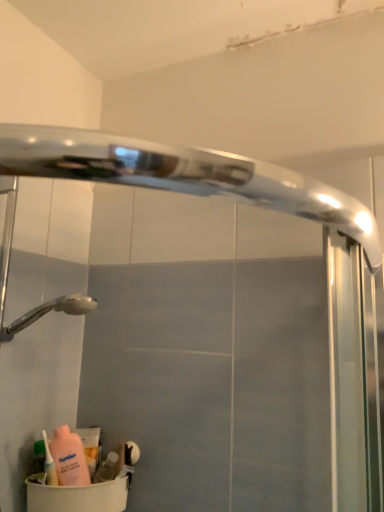
Describe the element at coordinates (90, 447) in the screenshot. I see `matte pink lotion at lower left, which is the second cleaning product in left-to-right order` at that location.

Locate an element on the screen. The image size is (384, 512). pink matte bottle at lower left, which is counted as the first cleaning product, starting from the left is located at coordinates (49, 463).

What do you see at coordinates (49, 463) in the screenshot? The height and width of the screenshot is (512, 384). I see `pink matte bottle at lower left, placed as the 2th cleaning product when sorted from right to left` at bounding box center [49, 463].

What do you see at coordinates (77, 496) in the screenshot?
I see `beige plastic container at lower left` at bounding box center [77, 496].

Find the location of a particular element. This screenshot has height=512, width=384. translucent plastic soap at lower left, acting as the 2th toiletry starting from the left is located at coordinates (107, 468).

Is matte pink lotion at lower left, positioned as the 1th cleaning product in back-to-front order, in front of or behind beige plastic container at lower left in the image?

Visually, matte pink lotion at lower left, positioned as the 1th cleaning product in back-to-front order, is located behind beige plastic container at lower left.

Does matte pink lotion at lower left, positioned as the 1th cleaning product in back-to-front order, appear on the left side of beige plastic container at lower left?

In fact, matte pink lotion at lower left, positioned as the 1th cleaning product in back-to-front order, is to the right of beige plastic container at lower left.

From a real-world perspective, relative to beige plastic container at lower left, is matte pink lotion at lower left, positioned as the 1th cleaning product in back-to-front order, vertically above or below?

In terms of real-world spatial position, matte pink lotion at lower left, positioned as the 1th cleaning product in back-to-front order, is above beige plastic container at lower left.

How many degrees apart are the facing directions of matte pink lotion at lower left, acting as the 2th cleaning product starting from the front, and pink matte bottle at lower left, placed as the 2th cleaning product when sorted from right to left?

4.29 degrees.

From the image's perspective, is matte pink lotion at lower left, which is the second cleaning product in left-to-right order, above or below pink matte bottle at lower left, which is counted as the first cleaning product, starting from the left?

A: Based on their image positions, matte pink lotion at lower left, which is the second cleaning product in left-to-right order, is located beneath pink matte bottle at lower left, which is counted as the first cleaning product, starting from the left.

Is point (92, 458) closer or farther from the camera than point (47, 472)?

Clearly, point (92, 458) is more distant from the camera than point (47, 472).

Between matte pink lotion at lower left, which is the second cleaning product in left-to-right order, and pink matte bottle at lower left, which is counted as the first cleaning product, starting from the left, which one has larger width?

matte pink lotion at lower left, which is the second cleaning product in left-to-right order.

Could you tell me if beige plastic container at lower left is turned towards green matte bottle at lower left, the first toiletry in the left-to-right sequence?

No, beige plastic container at lower left does not turn towards green matte bottle at lower left, the first toiletry in the left-to-right sequence.

From the image's perspective, is beige plastic container at lower left beneath green matte bottle at lower left, the first toiletry in the left-to-right sequence?

Yes.

Based on their positions, is beige plastic container at lower left located to the left or right of green matte bottle at lower left, which appears as the second toiletry when viewed from the right?

From the image, it's evident that beige plastic container at lower left is to the right of green matte bottle at lower left, which appears as the second toiletry when viewed from the right.

Is beige plastic container at lower left thinner than green matte bottle at lower left, which appears as the second toiletry when viewed from the right?

No, beige plastic container at lower left is not thinner than green matte bottle at lower left, which appears as the second toiletry when viewed from the right.

Based on the photo, from the image's perspective, is green matte bottle at lower left, which appears as the second toiletry when viewed from the right, on matte pink lotion at lower left, acting as the 2th cleaning product starting from the front?

Yes, from the image's perspective, green matte bottle at lower left, which appears as the second toiletry when viewed from the right, is above matte pink lotion at lower left, acting as the 2th cleaning product starting from the front.

Between point (44, 454) and point (91, 477), which one is positioned behind?

The point (91, 477) is behind.

Is green matte bottle at lower left, the first toiletry in the left-to-right sequence, turned away from matte pink lotion at lower left, which is the second cleaning product in left-to-right order?

green matte bottle at lower left, the first toiletry in the left-to-right sequence, is not turned away from matte pink lotion at lower left, which is the second cleaning product in left-to-right order.

How far apart are green matte bottle at lower left, the first toiletry in the left-to-right sequence, and matte pink lotion at lower left, positioned as the 1th cleaning product in back-to-front order?

green matte bottle at lower left, the first toiletry in the left-to-right sequence, and matte pink lotion at lower left, positioned as the 1th cleaning product in back-to-front order, are 5.20 inches apart.

How much distance is there between beige plastic container at lower left and pink matte bottle at lower left, placed as the 2th cleaning product when sorted from right to left?

The distance of beige plastic container at lower left from pink matte bottle at lower left, placed as the 2th cleaning product when sorted from right to left, is 3.19 inches.

Consider the image. Between beige plastic container at lower left and pink matte bottle at lower left, arranged as the first cleaning product when viewed from the front, which one is positioned behind?

Positioned behind is pink matte bottle at lower left, arranged as the first cleaning product when viewed from the front.

From a real-world perspective, is beige plastic container at lower left on top of pink matte bottle at lower left, arranged as the first cleaning product when viewed from the front?

Incorrect, from a real-world perspective, beige plastic container at lower left is lower than pink matte bottle at lower left, arranged as the first cleaning product when viewed from the front.

Is beige plastic container at lower left looking in the opposite direction of pink matte bottle at lower left, the second cleaning product when ordered from back to front?

No, beige plastic container at lower left is not facing away from pink matte bottle at lower left, the second cleaning product when ordered from back to front.

Locate an element on the screen. Image resolution: width=384 pixels, height=512 pixels. toiletry on the left of pink matte bottle at lower left, arranged as the first cleaning product when viewed from the front is located at coordinates (39, 457).

Does pink matte bottle at lower left, placed as the 2th cleaning product when sorted from right to left, have a greater width compared to green matte bottle at lower left, the first toiletry in the left-to-right sequence?

Yes.

Is pink matte bottle at lower left, arranged as the first cleaning product when viewed from the front, not within green matte bottle at lower left, the first toiletry in the left-to-right sequence?

pink matte bottle at lower left, arranged as the first cleaning product when viewed from the front, lies outside green matte bottle at lower left, the first toiletry in the left-to-right sequence,'s area.

From a real-world perspective, which is physically above, pink matte bottle at lower left, which is counted as the first cleaning product, starting from the left, or green matte bottle at lower left, the first toiletry in the left-to-right sequence?

In real-world perspective, pink matte bottle at lower left, which is counted as the first cleaning product, starting from the left, is above.

There is a beige plastic container at lower left. Find the location of `the 1st cleaning product above it (from a real-world perspective)`. the 1st cleaning product above it (from a real-world perspective) is located at coordinates (90, 447).

Is beige plastic container at lower left positioned with its back to matte pink lotion at lower left, acting as the 2th cleaning product starting from the front?

No, beige plastic container at lower left is not facing the opposite direction of matte pink lotion at lower left, acting as the 2th cleaning product starting from the front.

From the image's perspective, does beige plastic container at lower left appear higher than matte pink lotion at lower left, the 1th cleaning product viewed from the right?

No, from the image's perspective, beige plastic container at lower left is not over matte pink lotion at lower left, the 1th cleaning product viewed from the right.

Considering the positions of objects beige plastic container at lower left and matte pink lotion at lower left, the 1th cleaning product viewed from the right, in the image provided, who is behind, beige plastic container at lower left or matte pink lotion at lower left, the 1th cleaning product viewed from the right,?

matte pink lotion at lower left, the 1th cleaning product viewed from the right, is behind.

The width and height of the screenshot is (384, 512). What are the coordinates of `toilet bowl on the left of the matte pink lotion at lower left, acting as the 2th cleaning product starting from the front` in the screenshot? It's located at (77, 496).

This screenshot has width=384, height=512. I want to click on cleaning product to the right of pink matte bottle at lower left, placed as the 2th cleaning product when sorted from right to left, so coord(90,447).

Which object lies further to the anchor point matte pink lotion at lower left, the 1th cleaning product viewed from the right, green matte bottle at lower left, the first toiletry in the left-to-right sequence, or translucent plastic soap at lower left, acting as the 2th toiletry starting from the left?

The object further to matte pink lotion at lower left, the 1th cleaning product viewed from the right, is green matte bottle at lower left, the first toiletry in the left-to-right sequence.

Based on their spatial positions, is beige plastic container at lower left or translucent plastic soap at lower left, placed as the 1th toiletry when sorted from right to left, closer to pink matte bottle at lower left, arranged as the first cleaning product when viewed from the front?

beige plastic container at lower left lies closer to pink matte bottle at lower left, arranged as the first cleaning product when viewed from the front, than the other object.

Looking at this image, when comparing their distances from beige plastic container at lower left, does pink matte bottle at lower left, arranged as the first cleaning product when viewed from the front, or matte pink lotion at lower left, which is the second cleaning product in left-to-right order, seem closer?

pink matte bottle at lower left, arranged as the first cleaning product when viewed from the front, is positioned closer to the anchor beige plastic container at lower left.

Which object lies further to the anchor point translucent plastic soap at lower left, acting as the 2th toiletry starting from the left, beige plastic container at lower left or green matte bottle at lower left, the first toiletry in the left-to-right sequence?

green matte bottle at lower left, the first toiletry in the left-to-right sequence, is further to translucent plastic soap at lower left, acting as the 2th toiletry starting from the left.

Considering their positions, is beige plastic container at lower left positioned closer to green matte bottle at lower left, which appears as the second toiletry when viewed from the right, than translucent plastic soap at lower left, placed as the 1th toiletry when sorted from right to left?

beige plastic container at lower left is closer to green matte bottle at lower left, which appears as the second toiletry when viewed from the right.

Which object lies nearer to the anchor point pink matte bottle at lower left, arranged as the first cleaning product when viewed from the front, translucent plastic soap at lower left, placed as the 1th toiletry when sorted from right to left, or green matte bottle at lower left, the first toiletry in the left-to-right sequence?

The object closer to pink matte bottle at lower left, arranged as the first cleaning product when viewed from the front, is green matte bottle at lower left, the first toiletry in the left-to-right sequence.

Estimate the real-world distances between objects in this image. Which object is further from translucent plastic soap at lower left, acting as the 2th toiletry starting from the left, green matte bottle at lower left, which appears as the second toiletry when viewed from the right, or beige plastic container at lower left?

Based on the image, green matte bottle at lower left, which appears as the second toiletry when viewed from the right, appears to be further to translucent plastic soap at lower left, acting as the 2th toiletry starting from the left.

From the image, which object appears to be nearer to translucent plastic soap at lower left, acting as the 2th toiletry starting from the left, matte pink lotion at lower left, positioned as the 1th cleaning product in back-to-front order, or beige plastic container at lower left?

matte pink lotion at lower left, positioned as the 1th cleaning product in back-to-front order, is positioned closer to the anchor translucent plastic soap at lower left, acting as the 2th toiletry starting from the left.

Where is `toilet bowl between green matte bottle at lower left, which appears as the second toiletry when viewed from the right, and translucent plastic soap at lower left, placed as the 1th toiletry when sorted from right to left, from left to right`? Image resolution: width=384 pixels, height=512 pixels. toilet bowl between green matte bottle at lower left, which appears as the second toiletry when viewed from the right, and translucent plastic soap at lower left, placed as the 1th toiletry when sorted from right to left, from left to right is located at coordinates (77, 496).

You are a GUI agent. You are given a task and a screenshot of the screen. Output one action in this format:
    pyautogui.click(x=<x>, y=<y>)
    Task: Click on the cleaning product between beige plastic container at lower left and matte pink lotion at lower left, positioned as the 1th cleaning product in back-to-front order, along the z-axis
    
    Given the screenshot: What is the action you would take?
    pyautogui.click(x=49, y=463)

This screenshot has height=512, width=384. In order to click on cleaning product situated between pink matte bottle at lower left, the second cleaning product when ordered from back to front, and translucent plastic soap at lower left, acting as the 2th toiletry starting from the left, from left to right in this screenshot , I will do `click(90, 447)`.